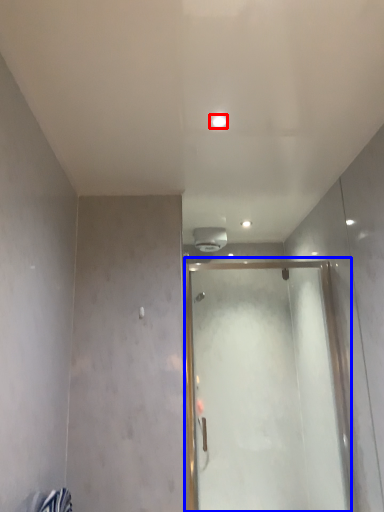
Question: Which of the following is the farthest to the observer, light (highlighted by a red box) or glass door (highlighted by a blue box)?

Choices:
 (A) light
 (B) glass door

Answer: (B)